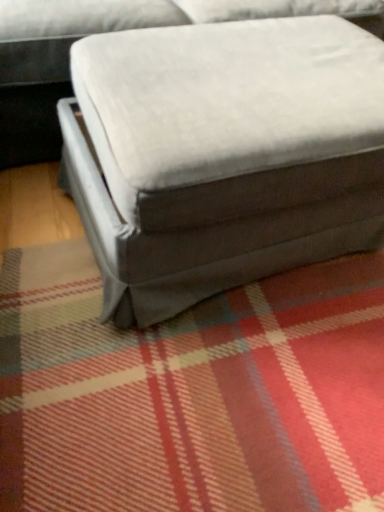
Question: In terms of size, does velvet gray ottoman at center appear bigger or smaller than velvet gray bean bag chair at center?

Choices:
 (A) small
 (B) big

Answer: (B)

Question: From a real-world perspective, relative to velvet gray bean bag chair at center, is velvet gray ottoman at center vertically above or below?

Choices:
 (A) below
 (B) above

Answer: (B)

Question: In terms of height, does velvet gray ottoman at center look taller or shorter compared to velvet gray bean bag chair at center?

Choices:
 (A) short
 (B) tall

Answer: (B)

Question: From a real-world perspective, is velvet gray bean bag chair at center above or below velvet gray ottoman at center?

Choices:
 (A) above
 (B) below

Answer: (B)

Question: Is point (132, 151) closer or farther from the camera than point (57, 155)?

Choices:
 (A) farther
 (B) closer

Answer: (B)

Question: Visually, is velvet gray bean bag chair at center positioned to the left or to the right of velvet gray ottoman at center?

Choices:
 (A) left
 (B) right

Answer: (B)

Question: From their relative heights in the image, would you say velvet gray bean bag chair at center is taller or shorter than velvet gray ottoman at center?

Choices:
 (A) tall
 (B) short

Answer: (B)